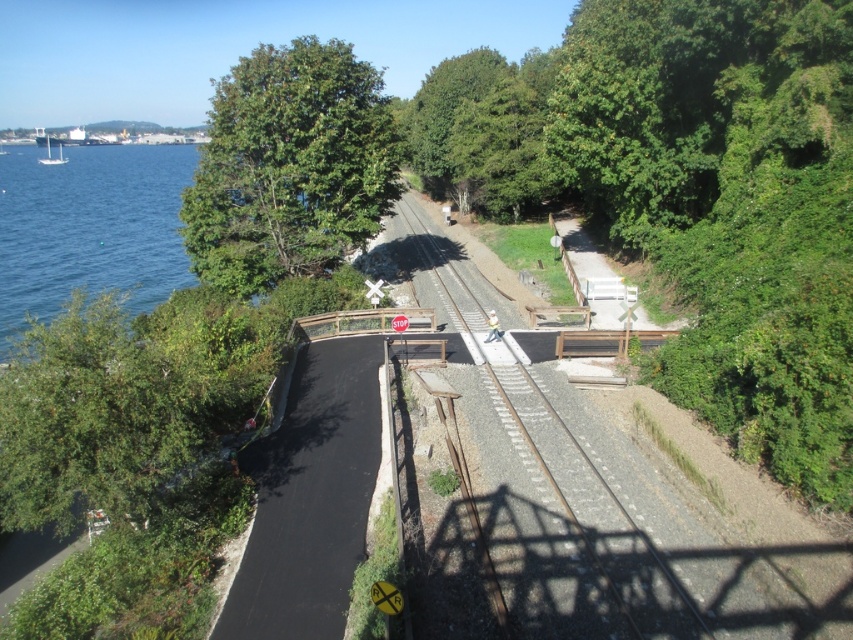
Is smooth metal train track at center above green leafy tree at upper left?

Actually, smooth metal train track at center is below green leafy tree at upper left.

At what (x,y) coordinates should I click in order to perform the action: click on smooth metal train track at center. Please return your answer as a coordinate pair (x, y). Image resolution: width=853 pixels, height=640 pixels. Looking at the image, I should click on (547, 476).

Where is `smooth metal train track at center`? This screenshot has height=640, width=853. smooth metal train track at center is located at coordinates (547, 476).